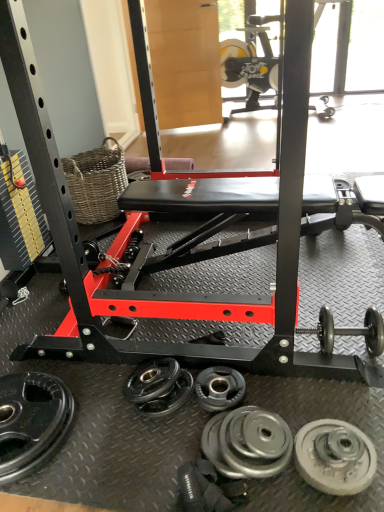
Question: Is there a large distance between woven brown basket at upper left and black rubber weight plate at center, the third wheel viewed from the right?

Choices:
 (A) yes
 (B) no

Answer: (A)

Question: Is the position of woven brown basket at upper left more distant than that of black rubber weight plate at center, the third wheel viewed from the right?

Choices:
 (A) no
 (B) yes

Answer: (B)

Question: Considering the relative sizes of woven brown basket at upper left and black rubber weight plate at center, the third wheel viewed from the right, in the image provided, is woven brown basket at upper left taller than black rubber weight plate at center, the third wheel viewed from the right,?

Choices:
 (A) no
 (B) yes

Answer: (B)

Question: Does woven brown basket at upper left contain black rubber weight plate at center, the third wheel viewed from the right?

Choices:
 (A) no
 (B) yes

Answer: (A)

Question: From the image's perspective, does woven brown basket at upper left appear higher than black rubber weight plate at center, the 2th wheel in the left-to-right sequence?

Choices:
 (A) yes
 (B) no

Answer: (A)

Question: Considering the relative positions of woven brown basket at upper left and black rubber weight plate at center, the third wheel viewed from the right, in the image provided, is woven brown basket at upper left to the right of black rubber weight plate at center, the third wheel viewed from the right, from the viewer's perspective?

Choices:
 (A) no
 (B) yes

Answer: (A)

Question: Is woven brown basket at upper left at the left side of black rubber weight plate at lower left, the 4th wheel from the right?

Choices:
 (A) yes
 (B) no

Answer: (A)

Question: Is woven brown basket at upper left further to camera compared to black rubber weight plate at lower left, the first wheel positioned from the left?

Choices:
 (A) no
 (B) yes

Answer: (B)

Question: From the image's perspective, is woven brown basket at upper left below black rubber weight plate at lower left, the 4th wheel from the right?

Choices:
 (A) yes
 (B) no

Answer: (B)

Question: From the image's perspective, is woven brown basket at upper left on black rubber weight plate at lower left, the first wheel positioned from the left?

Choices:
 (A) no
 (B) yes

Answer: (B)

Question: Can you confirm if woven brown basket at upper left is wider than black rubber weight plate at lower left, the 4th wheel from the right?

Choices:
 (A) no
 (B) yes

Answer: (B)

Question: Can you confirm if woven brown basket at upper left is taller than black rubber weight plate at lower left, the first wheel positioned from the left?

Choices:
 (A) yes
 (B) no

Answer: (A)

Question: Is silver metallic weight plate at lower center, which ranks as the third wheel in left-to-right order, completely or partially outside of polished silver dumbbell at lower right?

Choices:
 (A) no
 (B) yes

Answer: (B)